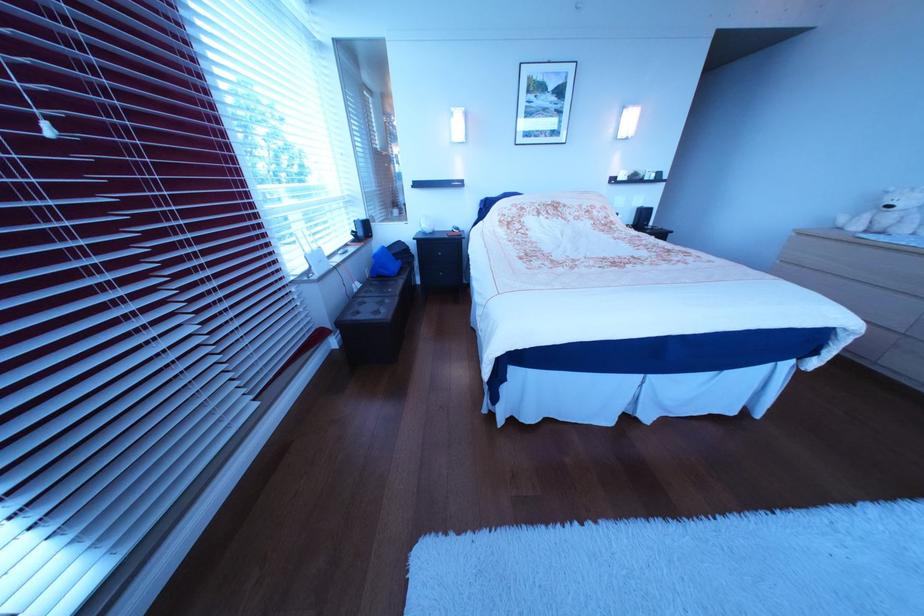
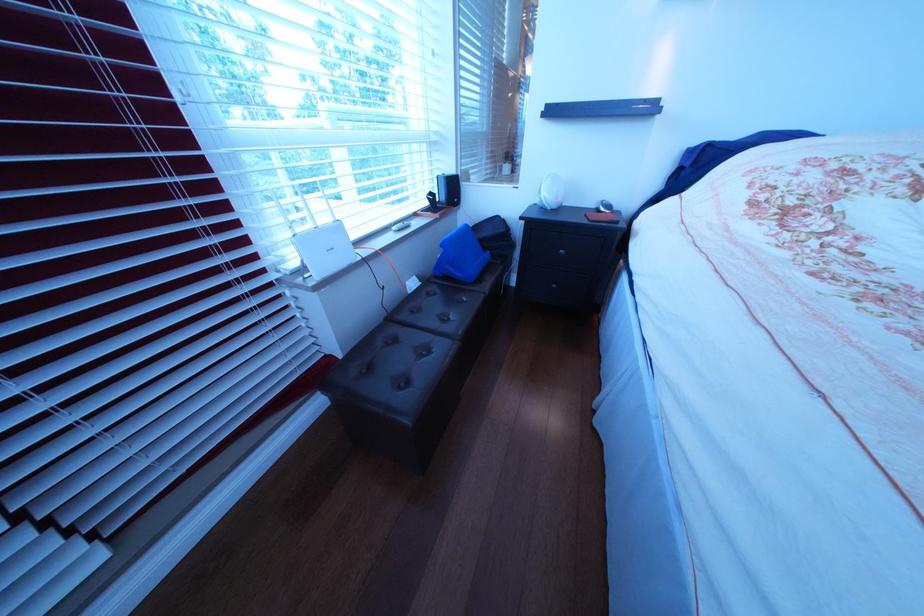
Question: Which direction would the cameraman need to move to produce the second image? Reply with the corresponding letter.

Choices:
 (A) Left
 (B) Right
 (C) Forward
 (D) Backward

Answer: (C)